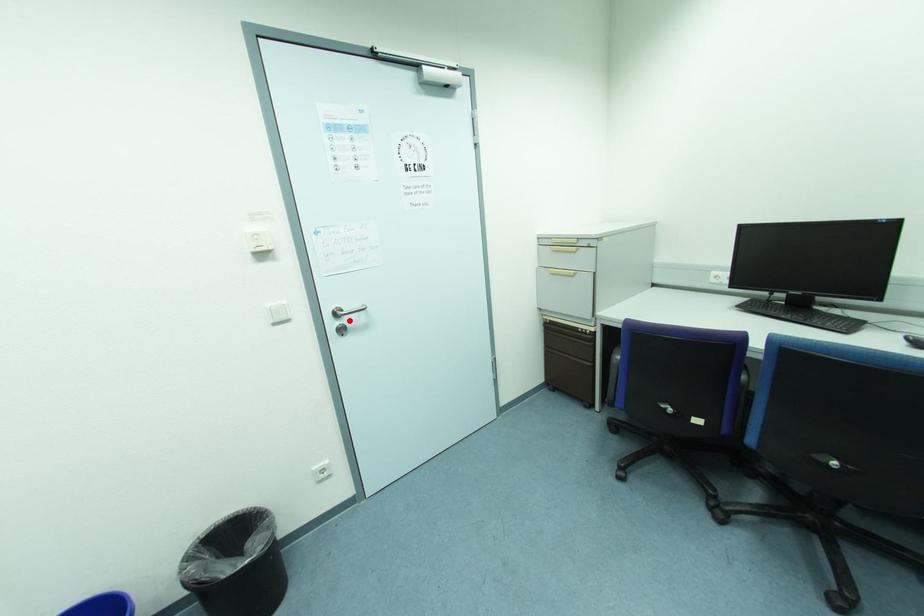
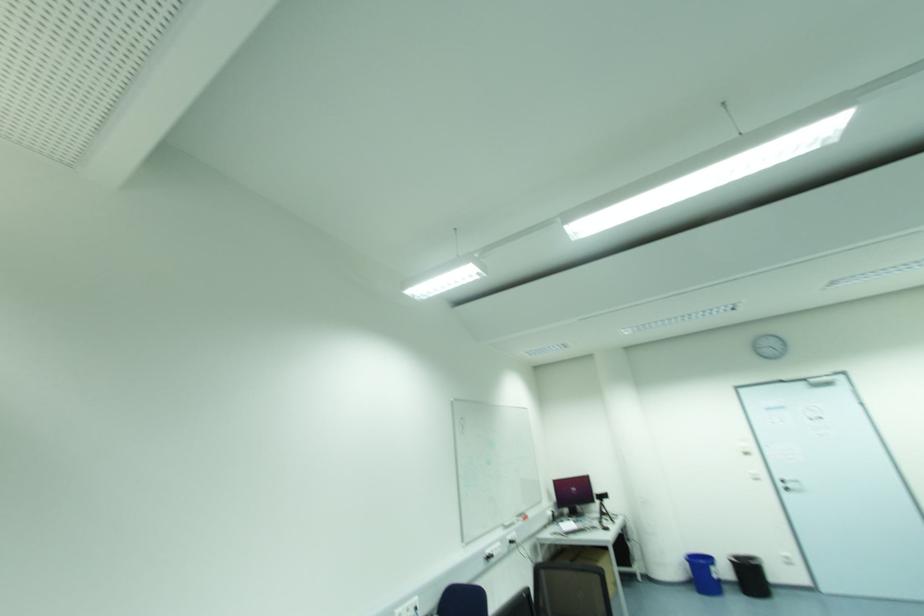
Question: A red point is marked in image1. In image2, is the corresponding 3D point closer to the camera or farther? Reply with the corresponding letter.

Choices:
 (A) The corresponding 3D point is closer.
 (B) The corresponding 3D point is farther.

Answer: (A)